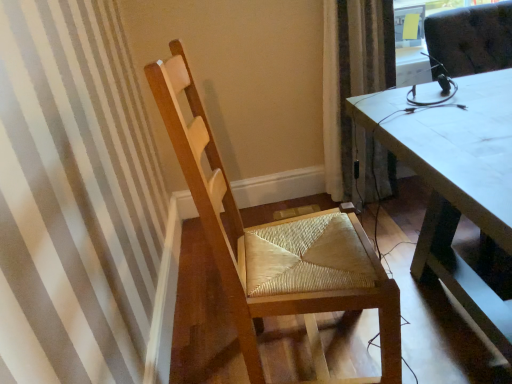
Question: Does brown textured curtain at upper right come behind natural wood chair at left?

Choices:
 (A) yes
 (B) no

Answer: (A)

Question: From the image's perspective, is brown textured curtain at upper right on natural wood chair at left?

Choices:
 (A) no
 (B) yes

Answer: (B)

Question: Does brown textured curtain at upper right have a greater width compared to natural wood chair at left?

Choices:
 (A) no
 (B) yes

Answer: (A)

Question: Considering the relative positions of brown textured curtain at upper right and natural wood chair at left in the image provided, is brown textured curtain at upper right to the left of natural wood chair at left from the viewer's perspective?

Choices:
 (A) no
 (B) yes

Answer: (A)

Question: Considering the relative positions of brown textured curtain at upper right and natural wood chair at left in the image provided, is brown textured curtain at upper right in front of natural wood chair at left?

Choices:
 (A) no
 (B) yes

Answer: (A)

Question: Does brown textured curtain at upper right appear on the right side of natural wood chair at left?

Choices:
 (A) yes
 (B) no

Answer: (A)

Question: From the image's perspective, is natural wood chair at left under brown textured curtain at upper right?

Choices:
 (A) yes
 (B) no

Answer: (A)

Question: Is natural wood chair at left turned away from brown textured curtain at upper right?

Choices:
 (A) no
 (B) yes

Answer: (A)

Question: Is natural wood chair at left not within brown textured curtain at upper right?

Choices:
 (A) no
 (B) yes

Answer: (B)

Question: Is natural wood chair at left beside brown textured curtain at upper right?

Choices:
 (A) no
 (B) yes

Answer: (A)

Question: Is natural wood chair at left facing towards brown textured curtain at upper right?

Choices:
 (A) no
 (B) yes

Answer: (A)

Question: From the image's perspective, does natural wood chair at left appear higher than brown textured curtain at upper right?

Choices:
 (A) yes
 (B) no

Answer: (B)

Question: Looking at their shapes, would you say brown textured curtain at upper right is wider or thinner than natural wood chair at left?

Choices:
 (A) thin
 (B) wide

Answer: (A)